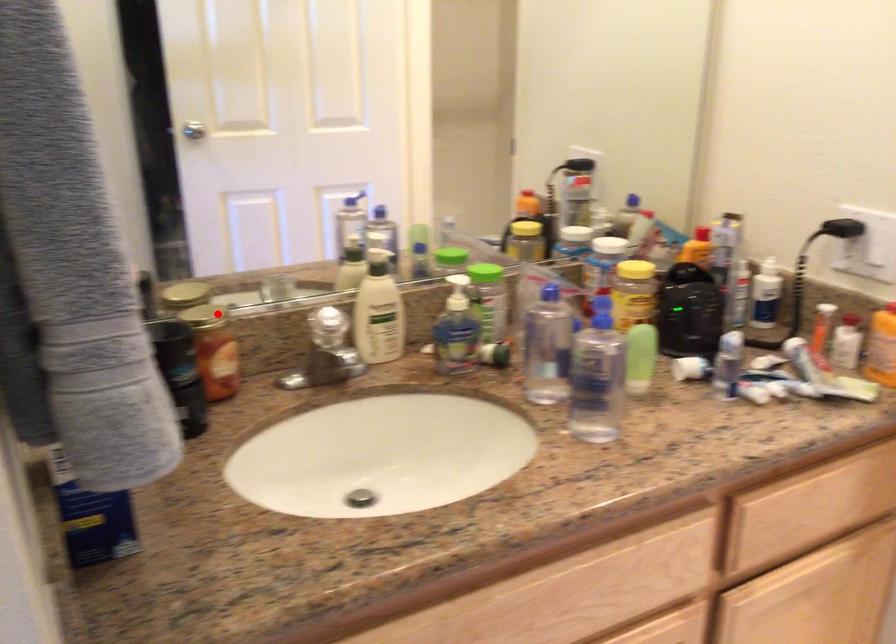
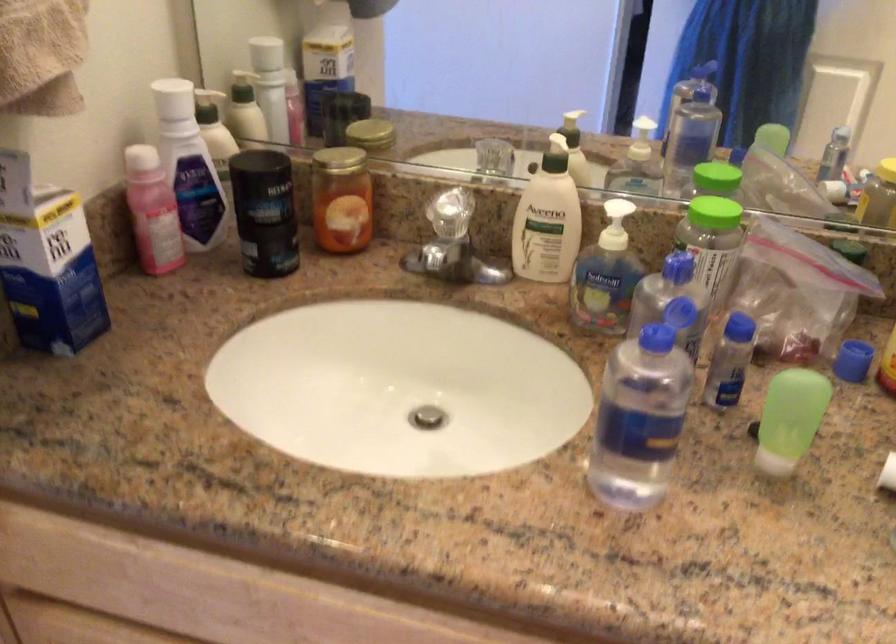
Question: A red point is marked in image1. In image2, is the corresponding 3D point closer to the camera or farther? Reply with the corresponding letter.

Choices:
 (A) The corresponding 3D point is closer.
 (B) The corresponding 3D point is farther.

Answer: (A)